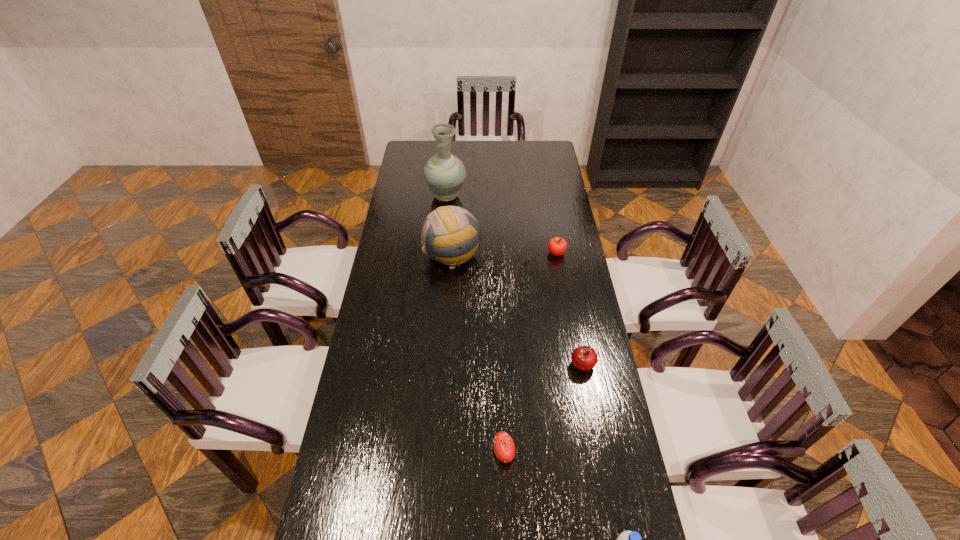
Locate an element on the screen. vacant area between the farthest apple and the fourth farthest object is located at coordinates (569, 309).

Where is `vacant point located between the second farthest apple and the farthest apple`? The height and width of the screenshot is (540, 960). vacant point located between the second farthest apple and the farthest apple is located at coordinates (569, 309).

Find the location of a particular element. This screenshot has width=960, height=540. free spot between the leftmost apple and the pitcher is located at coordinates point(475,325).

Where is `unoccupied area between the farthest apple and the fifth shortest object`? unoccupied area between the farthest apple and the fifth shortest object is located at coordinates pos(504,254).

The image size is (960, 540). I want to click on the third closest object to the second tallest object, so click(584, 358).

Identify which object is located as the fourth nearest to the second tallest object. Please provide its 2D coordinates. Your answer should be formatted as a tuple, i.e. [(x, y)], where the tuple contains the x and y coordinates of a point satisfying the conditions above.

[(504, 447)]

Locate which apple is the second closest to the volleyball. Please provide its 2D coordinates. Your answer should be formatted as a tuple, i.e. [(x, y)], where the tuple contains the x and y coordinates of a point satisfying the conditions above.

[(584, 358)]

The image size is (960, 540). In order to click on apple that stands as the third closest to the nearest object in this screenshot , I will do (x=557, y=246).

This screenshot has width=960, height=540. What are the coordinates of `free space that satisfies the following two spatial constraints: 1. on the front side of the second tallest object; 2. on the right side of the second farthest apple` in the screenshot? It's located at (445, 365).

The image size is (960, 540). What are the coordinates of `free space in the image that satisfies the following two spatial constraints: 1. on the back side of the farthest apple; 2. on the right side of the second nearest object` in the screenshot? It's located at (496, 253).